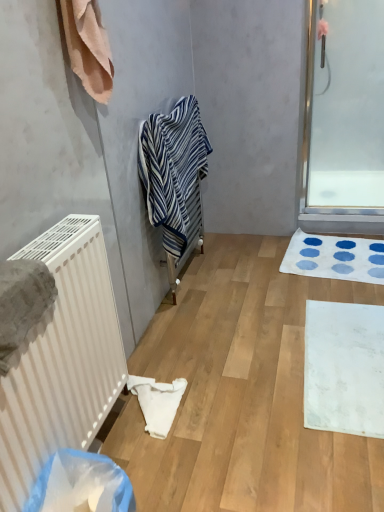
Question: Should I look upward or downward to see blue striped towel at center, which ranks as the first towel in right-to-left order?

Choices:
 (A) down
 (B) up

Answer: (B)

Question: Considering the relative sizes of white plastic radiator at left and transparent glass screen door at upper right in the image provided, is white plastic radiator at left taller than transparent glass screen door at upper right?

Choices:
 (A) yes
 (B) no

Answer: (B)

Question: Are white plastic radiator at left and transparent glass screen door at upper right located far from each other?

Choices:
 (A) no
 (B) yes

Answer: (B)

Question: From a real-world perspective, is white plastic radiator at left below transparent glass screen door at upper right?

Choices:
 (A) no
 (B) yes

Answer: (B)

Question: Can you confirm if white plastic radiator at left is bigger than transparent glass screen door at upper right?

Choices:
 (A) yes
 (B) no

Answer: (A)

Question: Does white plastic radiator at left have a greater width compared to transparent glass screen door at upper right?

Choices:
 (A) no
 (B) yes

Answer: (B)

Question: Could you tell me if white plastic radiator at left is turned towards transparent glass screen door at upper right?

Choices:
 (A) no
 (B) yes

Answer: (A)

Question: Does gray textured towel at left, the first towel viewed from the left, lie in front of white textured bath mat at lower right, which is the second bath mat from front to back?

Choices:
 (A) no
 (B) yes

Answer: (B)

Question: From the image's perspective, does gray textured towel at left, positioned as the 1th towel in front-to-back order, appear lower than white textured bath mat at lower right, placed as the second bath mat when sorted from bottom to top?

Choices:
 (A) yes
 (B) no

Answer: (A)

Question: Is gray textured towel at left, the first towel viewed from the left, wider than white textured bath mat at lower right, placed as the second bath mat when sorted from bottom to top?

Choices:
 (A) no
 (B) yes

Answer: (A)

Question: Can you confirm if gray textured towel at left, the 3th towel viewed from the back, is thinner than white textured bath mat at lower right, the first bath mat from the back?

Choices:
 (A) yes
 (B) no

Answer: (A)

Question: Is the position of gray textured towel at left, the first towel viewed from the left, more distant than that of white textured bath mat at lower right, the 1th bath mat positioned from the top?

Choices:
 (A) no
 (B) yes

Answer: (A)

Question: Is gray textured towel at left, the 3th towel viewed from the back, shorter than white textured bath mat at lower right, the first bath mat from the back?

Choices:
 (A) no
 (B) yes

Answer: (A)

Question: Can you confirm if white matte bath mat at lower right, the 2th bath mat from the top, is taller than beige cotton towel at upper left, marked as the second towel in a right-to-left arrangement?

Choices:
 (A) no
 (B) yes

Answer: (A)